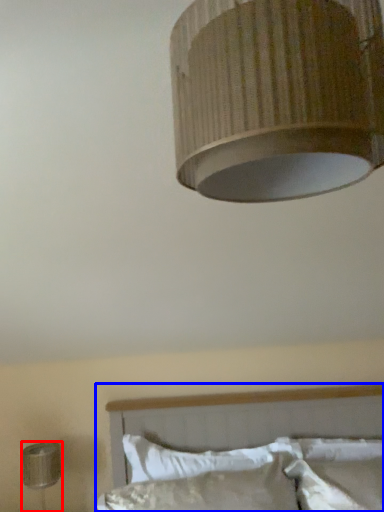
Question: Which object appears farthest to the camera in this image, lamp (highlighted by a red box) or bed (highlighted by a blue box)?

Choices:
 (A) lamp
 (B) bed

Answer: (A)